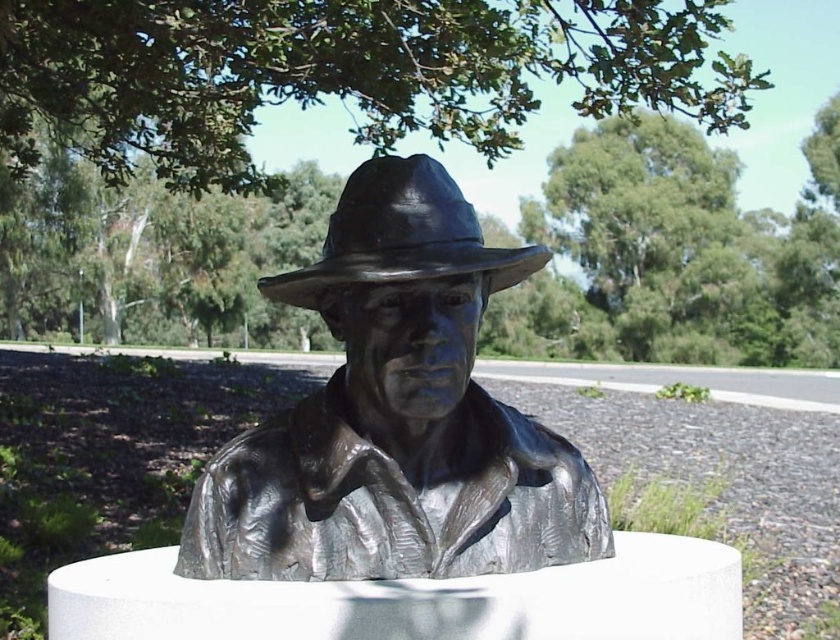
Question: Which object appears closest to the camera in this image?

Choices:
 (A) bronze statue at center
 (B) shiny black fedora at center

Answer: (A)

Question: Which point is closer to the camera?

Choices:
 (A) shiny black fedora at center
 (B) bronze statue at center

Answer: (B)

Question: Which is farther from the bronze statue at center?

Choices:
 (A) shiny black fedora at center
 (B) green leafy tree at upper center

Answer: (B)

Question: In this image, where is bronze statue at center located relative to shiny black fedora at center?

Choices:
 (A) below
 (B) above

Answer: (A)

Question: Does green leafy tree at upper center appear under shiny black fedora at center?

Choices:
 (A) yes
 (B) no

Answer: (B)

Question: Is bronze statue at center thinner than shiny black fedora at center?

Choices:
 (A) yes
 (B) no

Answer: (B)